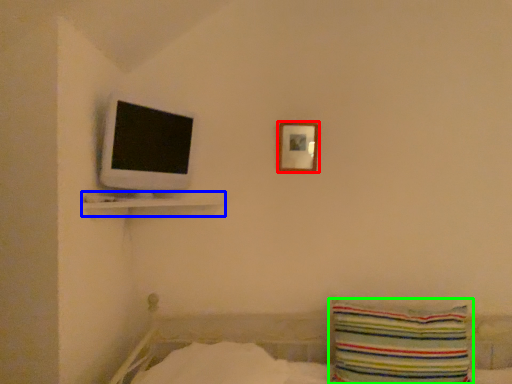
Question: Considering the real-world distances, which object is farthest from picture frame (highlighted by a red box)? shelf (highlighted by a blue box) or pillow (highlighted by a green box)?

Choices:
 (A) shelf
 (B) pillow

Answer: (B)